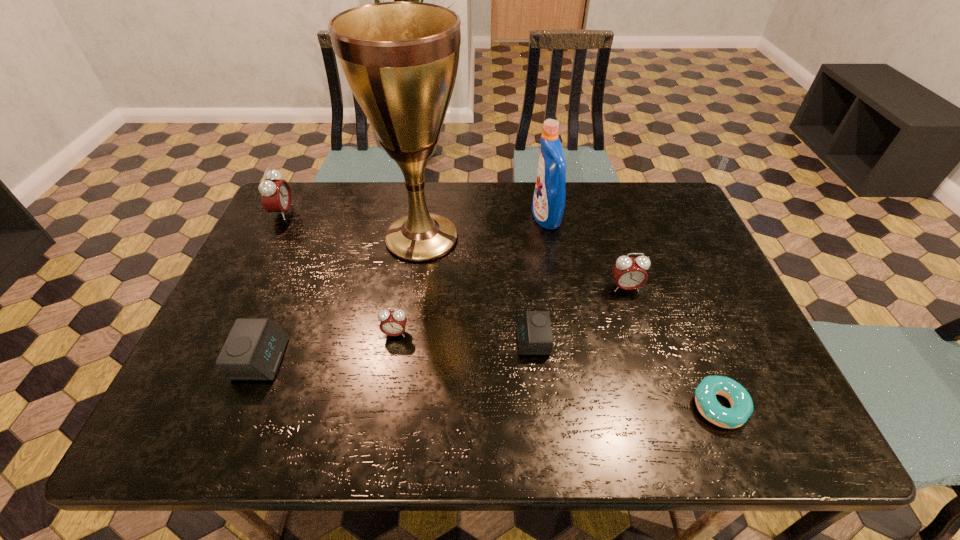
You are a GUI agent. You are given a task and a screenshot of the screen. Output one action in this format:
    pyautogui.click(x=<x>, y=<y>)
    Task: Click on the vacant space located on the clock face of the leftmost alarm clock
    The image size is (960, 540).
    Given the screenshot: What is the action you would take?
    pyautogui.click(x=340, y=213)

Locate an element on the screen. vacant position located 0.270m on the clock face of the second nearest pink alarm clock is located at coordinates point(657,388).

Locate an element on the screen. The image size is (960, 540). free space located 0.170m on the clock face of the smallest pink alarm clock is located at coordinates (383, 406).

At what (x,y) coordinates should I click in order to perform the action: click on vacant space located 0.060m on the front-facing side of the bigger black alarm clock. Please return your answer as a coordinate pair (x, y). The height and width of the screenshot is (540, 960). Looking at the image, I should click on (309, 359).

The width and height of the screenshot is (960, 540). In order to click on free spot located on the front-facing side of the second alarm clock from right to left in this screenshot , I will do 354,341.

At what (x,y) coordinates should I click in order to perform the action: click on vacant space located 0.390m on the front-facing side of the second alarm clock from right to left. Please return your answer as a coordinate pair (x, y). The width and height of the screenshot is (960, 540). Looking at the image, I should click on (350, 341).

The image size is (960, 540). In order to click on free space located on the front-facing side of the second alarm clock from right to left in this screenshot , I will do `click(397, 341)`.

You are a GUI agent. You are given a task and a screenshot of the screen. Output one action in this format:
    pyautogui.click(x=<x>, y=<y>)
    Task: Click on the free space located on the left of the rightmost object
    The height and width of the screenshot is (540, 960).
    Given the screenshot: What is the action you would take?
    pyautogui.click(x=557, y=406)

At what (x,y) coordinates should I click in order to perform the action: click on trophy cup located at the far edge. Please return your answer as a coordinate pair (x, y). This screenshot has height=540, width=960. Looking at the image, I should click on (400, 59).

The height and width of the screenshot is (540, 960). What are the coordinates of `detergent situated at the far edge` in the screenshot? It's located at (548, 204).